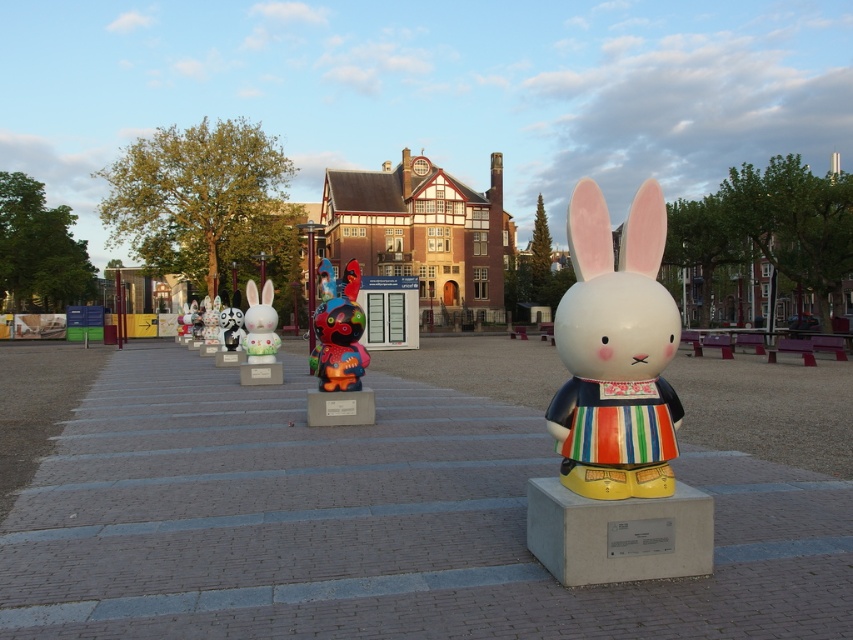
Based on the photo, which is above, matte ceramic rabbit at center or shiny multicolored rabbit at center?

matte ceramic rabbit at center is higher up.

Can you confirm if matte ceramic rabbit at center is positioned above shiny multicolored rabbit at center?

Yes.

Where is `matte ceramic rabbit at center`? This screenshot has height=640, width=853. matte ceramic rabbit at center is located at coordinates (614, 353).

Which is more to the right, shiny multicolored rabbit at center or white glossy rabbit at center?

From the viewer's perspective, shiny multicolored rabbit at center appears more on the right side.

Can you confirm if shiny multicolored rabbit at center is smaller than white glossy rabbit at center?

Yes, shiny multicolored rabbit at center is smaller than white glossy rabbit at center.

Measure the distance between point (334, 285) and camera.

They are 35.67 feet apart.

This screenshot has width=853, height=640. Identify the location of shiny multicolored rabbit at center. (338, 330).

Which of these two, matte ceramic rabbit at center or white glossy rabbit at center, stands taller?

white glossy rabbit at center

Does matte ceramic rabbit at center have a greater height compared to white glossy rabbit at center?

No, matte ceramic rabbit at center is not taller than white glossy rabbit at center.

Locate an element on the screen. matte ceramic rabbit at center is located at coordinates (614, 353).